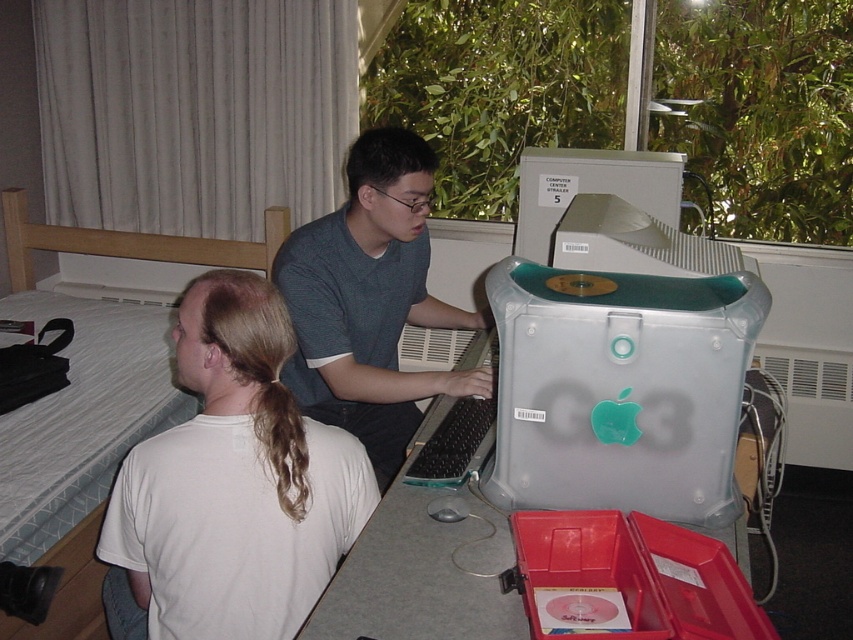
Between point (407, 230) and point (67, 611), which one is positioned in front?

Point (407, 230) is in front.

Can you confirm if matte gray shirt at center is taller than white quilted fabric bed at left?

Yes.

What do you see at coordinates (370, 301) in the screenshot? The width and height of the screenshot is (853, 640). I see `matte gray shirt at center` at bounding box center [370, 301].

The height and width of the screenshot is (640, 853). Identify the location of matte gray shirt at center. (370, 301).

Can you confirm if white matte shirt at back is bigger than gray plastic desktop computer at upper center?

Correct, white matte shirt at back is larger in size than gray plastic desktop computer at upper center.

Is point (247, 330) positioned behind point (676, 218)?

That is False.

Identify the location of white matte shirt at back. (231, 484).

Image resolution: width=853 pixels, height=640 pixels. Find the location of `matte gray shirt at center`. matte gray shirt at center is located at coordinates (370, 301).

Who is shorter, matte gray shirt at center or matte plastic computer desk at center?

matte plastic computer desk at center is shorter.

At what (x,y) coordinates should I click in order to perform the action: click on matte gray shirt at center. Please return your answer as a coordinate pair (x, y). Looking at the image, I should click on (370, 301).